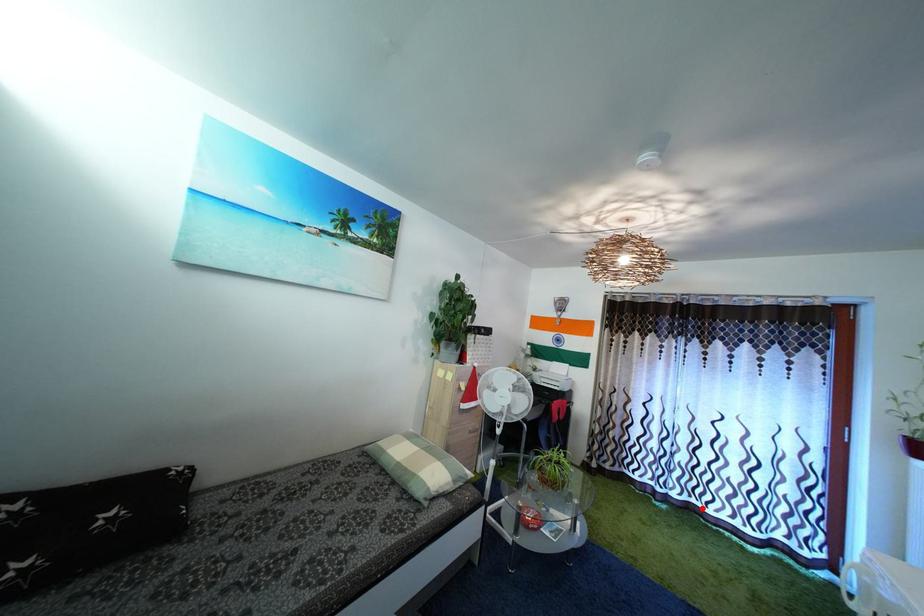
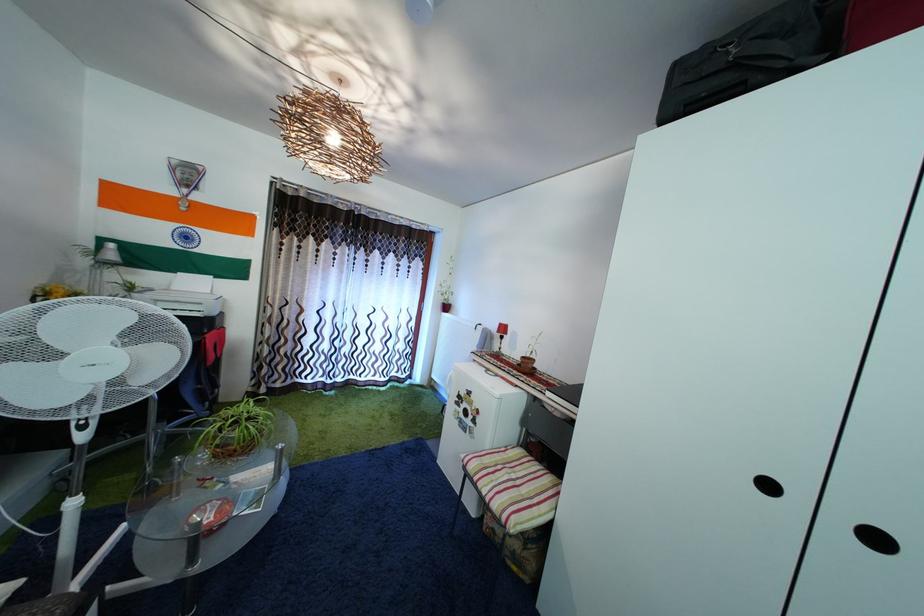
Question: A red point is marked in image1. In image2, is the corresponding 3D point closer to the camera or farther? Reply with the corresponding letter.

Choices:
 (A) The corresponding 3D point is closer.
 (B) The corresponding 3D point is farther.

Answer: (B)